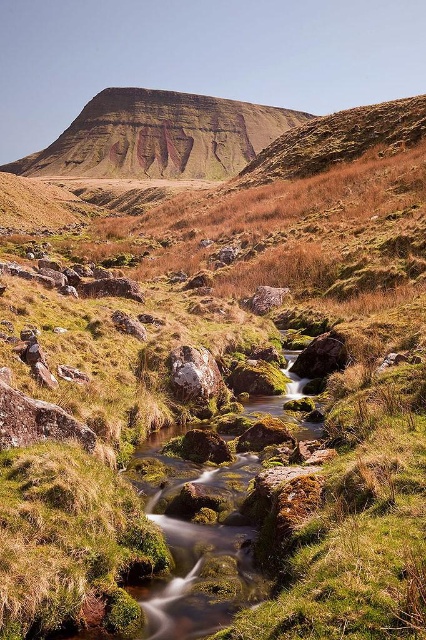
Consider the image. Which is above, rustic brown rock formation at center or rusty metallic rock at center?

Positioned higher is rustic brown rock formation at center.

Does point (230, 150) come behind point (210, 358)?

Yes, point (230, 150) is behind point (210, 358).

Where is `rustic brown rock formation at center`? The width and height of the screenshot is (426, 640). rustic brown rock formation at center is located at coordinates (160, 136).

Does rusty metallic rock at center appear on the right side of smooth gray rock at center?

In fact, rusty metallic rock at center is to the left of smooth gray rock at center.

Who is taller, rusty metallic rock at center or smooth gray rock at center?

rusty metallic rock at center

Image resolution: width=426 pixels, height=640 pixels. Describe the element at coordinates (193, 372) in the screenshot. I see `rusty metallic rock at center` at that location.

Where is `rusty metallic rock at center`? The height and width of the screenshot is (640, 426). rusty metallic rock at center is located at coordinates (193, 372).

Can you confirm if rustic brown rock formation at center is positioned above smooth gray rock at center?

Yes.

How distant is rustic brown rock formation at center from smooth gray rock at center?

rustic brown rock formation at center is 273.91 meters away from smooth gray rock at center.

Is point (187, 157) positioned behind point (284, 296)?

That is True.

Locate an element on the screen. This screenshot has height=640, width=426. rustic brown rock formation at center is located at coordinates (160, 136).